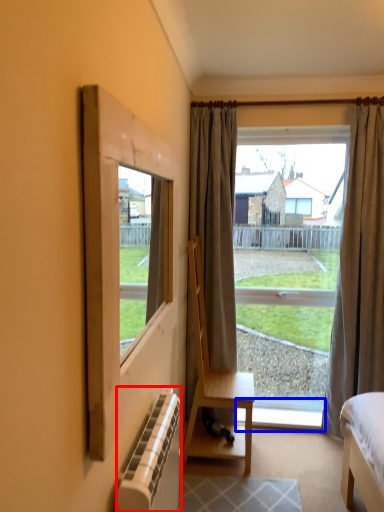
Question: Which of the following is the farthest to the observer, radiator (highlighted by a red box) or window sill (highlighted by a blue box)?

Choices:
 (A) radiator
 (B) window sill

Answer: (B)